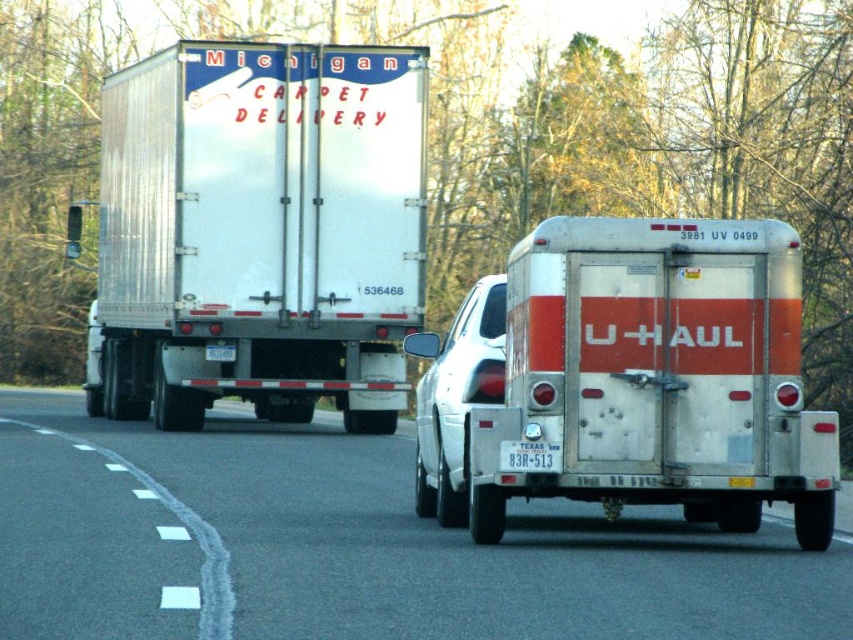
You are a pedestrian standing on the sidewalk and see the silver metallic trailer truck at center and the white glossy car at center. Which vehicle is blocking your view of the other?

The silver metallic trailer truck at center is positioned over the white glossy car at center, so it is blocking the view of the white glossy car at center.